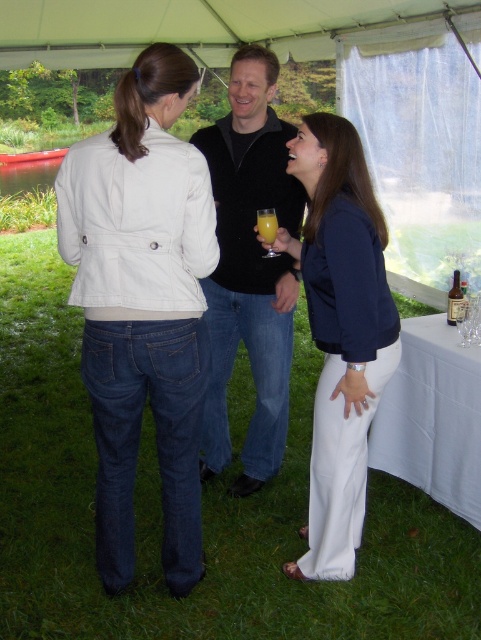
You are standing in the outdoor gathering area and want to place a small table between the two points labeled point (340, 442) and point (277, 221). Which point should the table be closer to so that it is nearer to the person on the left wearing a white jacket and blue jeans?

The table should be placed closer to point (277, 221) because it is farther from the viewer compared to point (340, 442), which is closer. Since the person on the left is facing away from the camera, their position relative to the points might require the table to be near the farther point to be near them.

Looking at this image, you are at a park and see two items in the distance. There is a matte blue jacket at center and a translucent glass at center. Which one is positioned more to the right?

The matte blue jacket at center is positioned to the right of the translucent glass at center, so the matte blue jacket at center is more to the right.